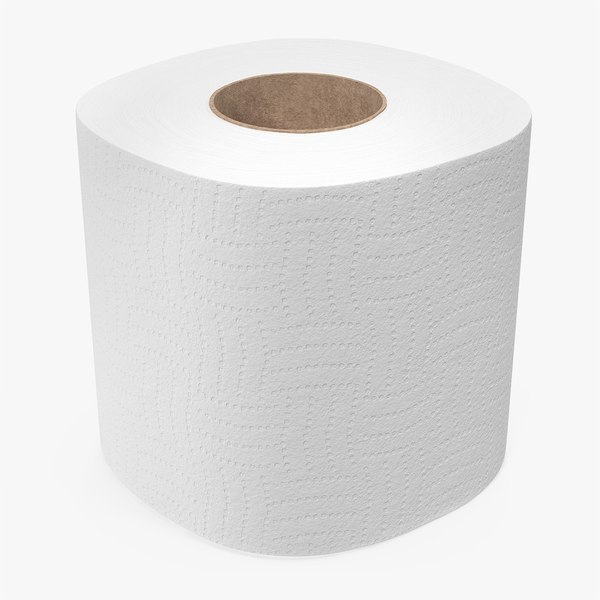
Find the location of a particular element. The width and height of the screenshot is (600, 600). white toilet paper is located at coordinates (246, 217), (275, 474).